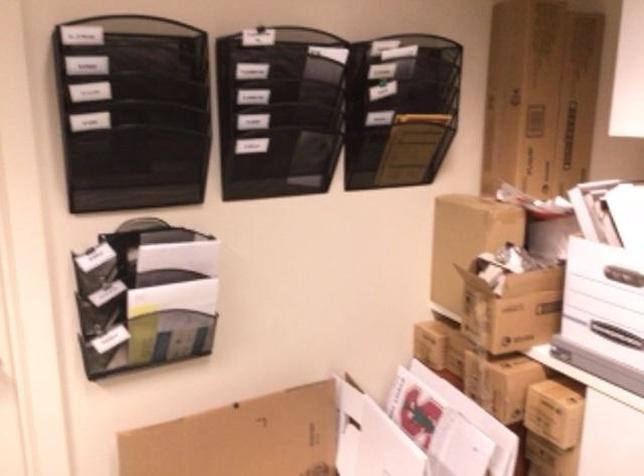
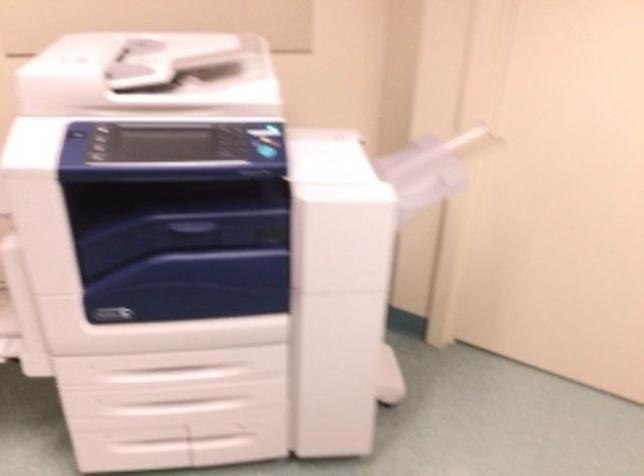
Consider the image. The first image is from the beginning of the video and the second image is from the end. How did the camera likely rotate when shooting the video?

The camera's rotation is toward left-down.